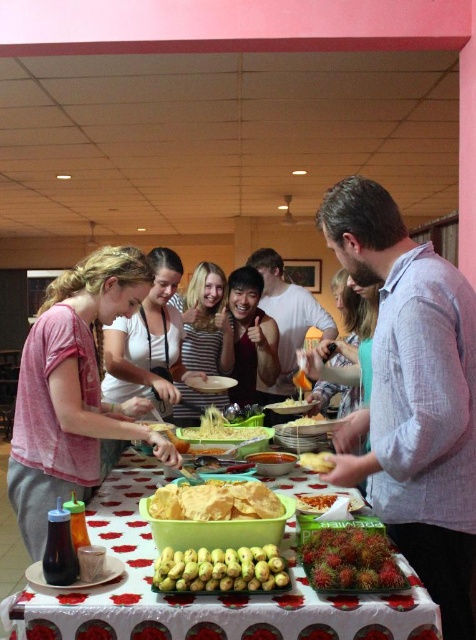
Is point (214, 576) positioned behind point (307, 497)?

No, it is in front of (307, 497).

Is point (217, 577) less distant than point (323, 502)?

Yes, point (217, 577) is closer to viewer.

Locate an element on the screen. yellow matte bananas at center is located at coordinates (220, 570).

Which of these two, yellow matte bananas at center or white matte pasta at center, stands shorter?

white matte pasta at center is shorter.

Between yellow matte bananas at center and white matte pasta at center, which one has more height?

yellow matte bananas at center is taller.

Between point (273, 580) and point (304, 406), which one is positioned behind?

Positioned behind is point (304, 406).

Find the location of a particular element. Image resolution: width=476 pixels, height=640 pixels. yellow matte bananas at center is located at coordinates (220, 570).

Which is more to the left, yellow matte chips at center or yellow matte cheese at center?

Positioned to the left is yellow matte chips at center.

Find the location of a particular element. Image resolution: width=476 pixels, height=640 pixels. yellow matte chips at center is located at coordinates (215, 500).